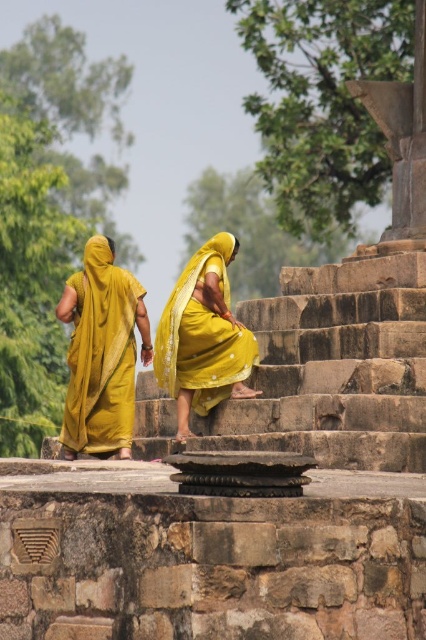
You are a photographer positioned at the bottom of the stone steps. You want to capture both the matte yellow sari at left and the yellow silk saree at center in a single frame. Which direction should you move to ensure both are visible?

Since the matte yellow sari at left is to the left of the yellow silk saree at center, you should move to the left side to capture both in your frame.

Looking at this image, you are a photographer standing at the bottom of the steps. You want to capture both the matte yellow sari at left and the yellow silk saree at center in a single frame. Given that your camera has a maximum focal length that can cover 4 meters, will you be able to include both in the photo?

The distance between the matte yellow sari at left and the yellow silk saree at center is 4.12 meters. Since your camera can only cover 4 meters, you will not be able to include both in a single frame without moving closer or adjusting your position.

You are standing at the base of the stone steps in the image and want to take a photo of the two individuals in vibrant yellow sarees. If you focus your camera on point 1 at point (115, 452), will point 2 at point (189, 307) also be in focus? Explain your reasoning based on their positions.

Point 1 at point (115, 452) is further to the camera than point 2 at point (189, 307). Since both points are at different distances from the camera, focusing on point 1 may not ensure point 2 is in focus unless the depth of field is sufficient to cover both distances. However, without knowing the camera settings, it is uncertain if both will be in focus.